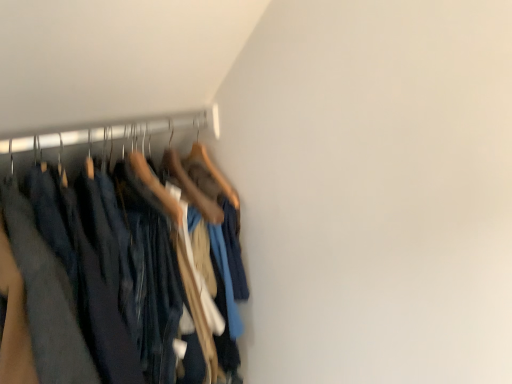
What is the approximate width of dark blue denim trousers at left?

dark blue denim trousers at left is 60.65 centimeters wide.

The image size is (512, 384). What are the coordinates of `dark blue denim trousers at left` in the screenshot? It's located at (109, 280).

What do you see at coordinates (109, 280) in the screenshot? The image size is (512, 384). I see `dark blue denim trousers at left` at bounding box center [109, 280].

Locate an element on the screen. Image resolution: width=512 pixels, height=384 pixels. dark blue denim trousers at left is located at coordinates (109, 280).